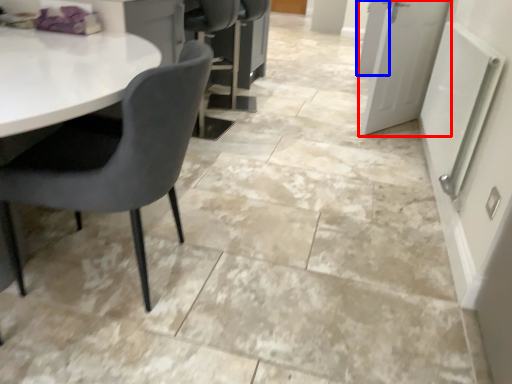
Question: Which object is closer to the camera taking this photo, door (highlighted by a red box) or door (highlighted by a blue box)?

Choices:
 (A) door
 (B) door

Answer: (A)